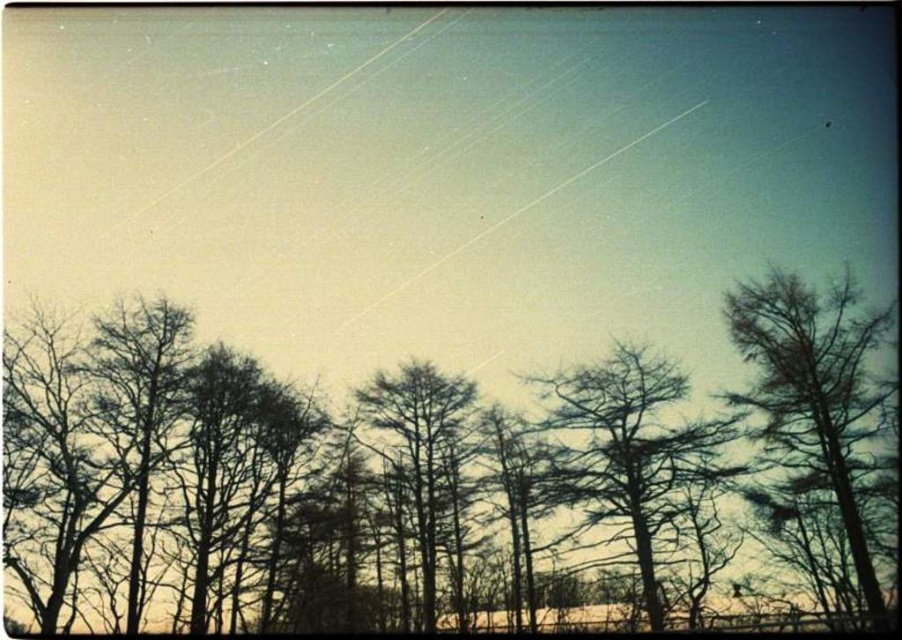
Who is more distant from viewer, (x=408, y=582) or (x=826, y=460)?

The point (x=408, y=582) is more distant.

Can you confirm if brown matte trees at center is wider than green leafy tree at upper right?

Yes.

Who is more distant from viewer, [586,513] or [783,436]?

Point [783,436]

Where is `brown matte trees at center`? This screenshot has width=902, height=640. brown matte trees at center is located at coordinates (440, 481).

Measure the distance between point (x=719, y=428) and camera.

A distance of 42.28 meters exists between point (x=719, y=428) and camera.

Is point (674, 428) positioned behind point (417, 449)?

No, (674, 428) is in front of (417, 449).

Which is behind, point (650, 445) or point (434, 490)?

The point (434, 490) is more distant.

Where is `brown textured tree at center`? This screenshot has width=902, height=640. brown textured tree at center is located at coordinates (627, 454).

The image size is (902, 640). What are the coordinates of `green leafy tree at upper right` in the screenshot? It's located at (815, 396).

Image resolution: width=902 pixels, height=640 pixels. Describe the element at coordinates (815, 396) in the screenshot. I see `green leafy tree at upper right` at that location.

Find the location of `green leafy tree at upper right`. green leafy tree at upper right is located at coordinates (815, 396).